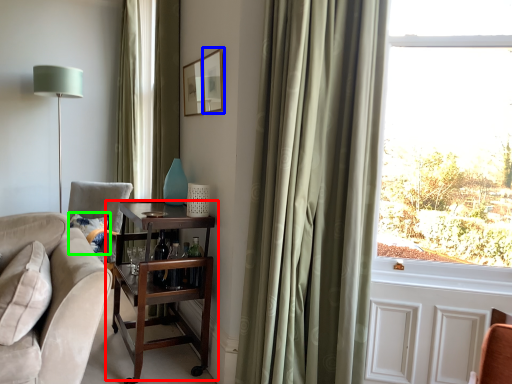
Question: Which object is positioned closest to table (highlighted by a red box)? Select from picture frame (highlighted by a blue box) and pillow (highlighted by a green box).

Choices:
 (A) picture frame
 (B) pillow

Answer: (B)